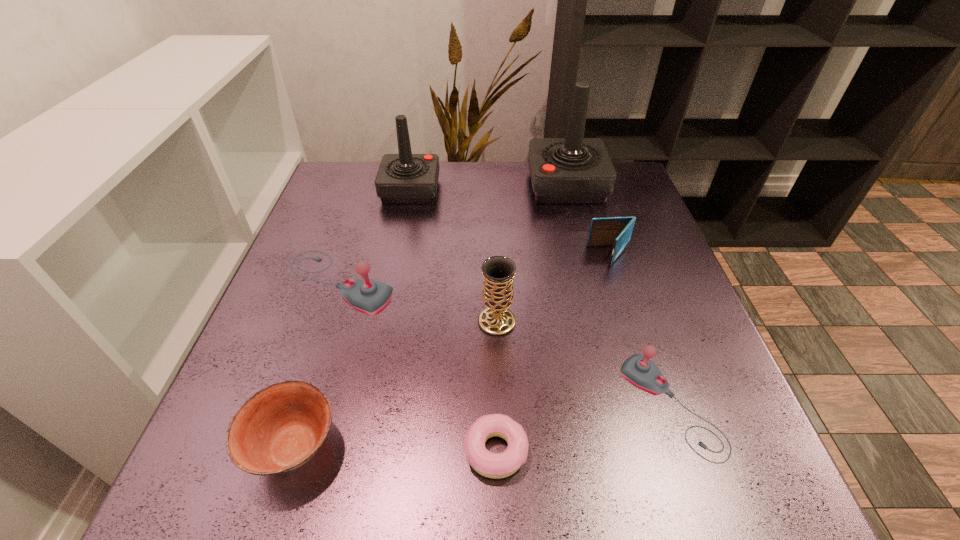
The image size is (960, 540). I want to click on bowl, so click(279, 428).

What are the coordinates of `the shortest object` in the screenshot? It's located at (493, 465).

Identify the location of pink doughnut. (493, 465).

Locate an element on the screen. vacant space located on the front-facing side of the bigger red joystick is located at coordinates (414, 185).

At what (x,y) coordinates should I click in order to perform the action: click on vacant space located 0.280m on the front-facing side of the bigger red joystick. Please return your answer as a coordinate pair (x, y). Looking at the image, I should click on (428, 185).

You are a GUI agent. You are given a task and a screenshot of the screen. Output one action in this format:
    pyautogui.click(x=<x>, y=<y>)
    Task: Click on the vacant region located on the front-facing side of the bigger red joystick
    Image resolution: width=960 pixels, height=540 pixels.
    Given the screenshot: What is the action you would take?
    pyautogui.click(x=432, y=185)

Image resolution: width=960 pixels, height=540 pixels. I want to click on blank space located on the front-facing side of the seventh shortest object, so click(541, 190).

At what (x,y) coordinates should I click in order to perform the action: click on free region located on the front of the chalice. Please return your answer as a coordinate pair (x, y). Image resolution: width=960 pixels, height=540 pixels. Looking at the image, I should click on (500, 430).

The image size is (960, 540). What are the coordinates of `vacant space situated 0.380m on the back of the farther gray joystick` in the screenshot? It's located at (377, 167).

Where is `vacant region located 0.370m on the exterior surface of the blue wallet`? This screenshot has width=960, height=540. vacant region located 0.370m on the exterior surface of the blue wallet is located at coordinates (427, 256).